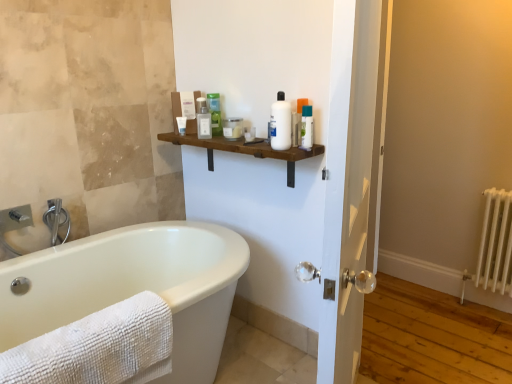
The height and width of the screenshot is (384, 512). Find the location of `free region under white metallic radiator at right (from a real-world perspective)`. free region under white metallic radiator at right (from a real-world perspective) is located at coordinates coord(474,313).